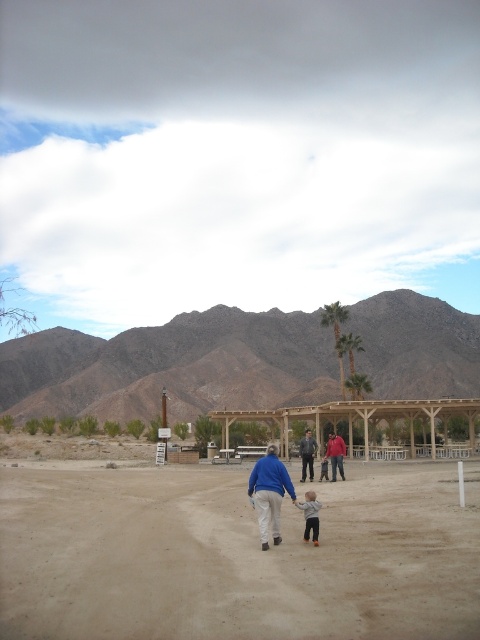
Between light gray cotton shirt at center and leather jacket at center, which one has less height?

With less height is light gray cotton shirt at center.

Can you confirm if light gray cotton shirt at center is taller than leather jacket at center?

No, light gray cotton shirt at center is not taller than leather jacket at center.

Between point (302, 538) and point (300, 449), which one is positioned in front?

Positioned in front is point (302, 538).

Locate an element on the screen. This screenshot has width=480, height=640. light gray cotton shirt at center is located at coordinates (310, 515).

How distant is blue cotton shirt at center from red cotton shirt at center?

They are 15.86 meters apart.

The width and height of the screenshot is (480, 640). Find the location of `blue cotton shirt at center`. blue cotton shirt at center is located at coordinates (268, 493).

This screenshot has width=480, height=640. Identify the location of blue cotton shirt at center. click(x=268, y=493).

Which of these two, brown sandy ground at center or wooden gazebo at center, stands shorter?

Standing shorter between the two is brown sandy ground at center.

Who is more distant from viewer, (177, 529) or (407, 413)?

The point (407, 413) is more distant.

Is point (128, 554) positioned after point (412, 440)?

No, it is not.

This screenshot has width=480, height=640. In order to click on brown sandy ground at center in this screenshot , I will do `click(236, 557)`.